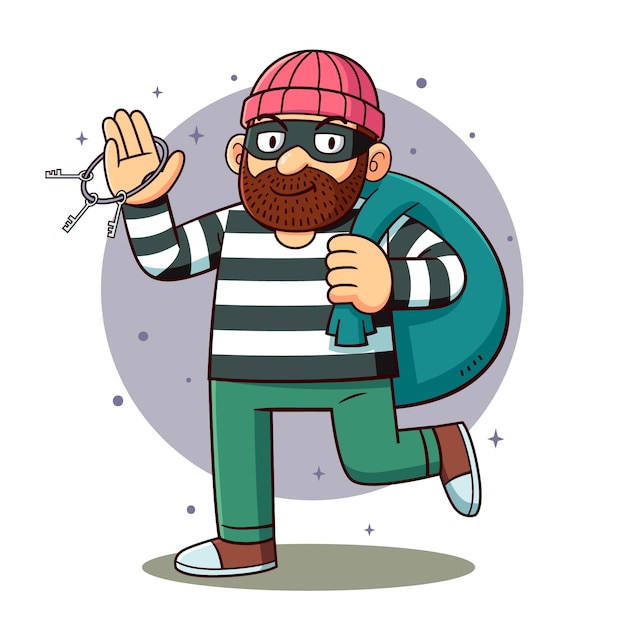
The width and height of the screenshot is (626, 626). What are the coordinates of `keys` in the screenshot? It's located at (111, 226), (69, 218), (54, 170).